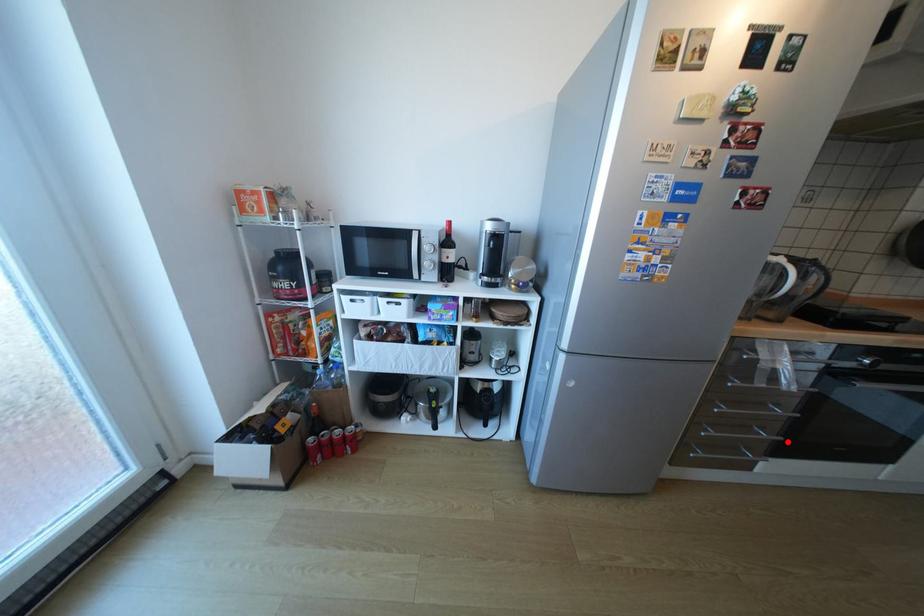
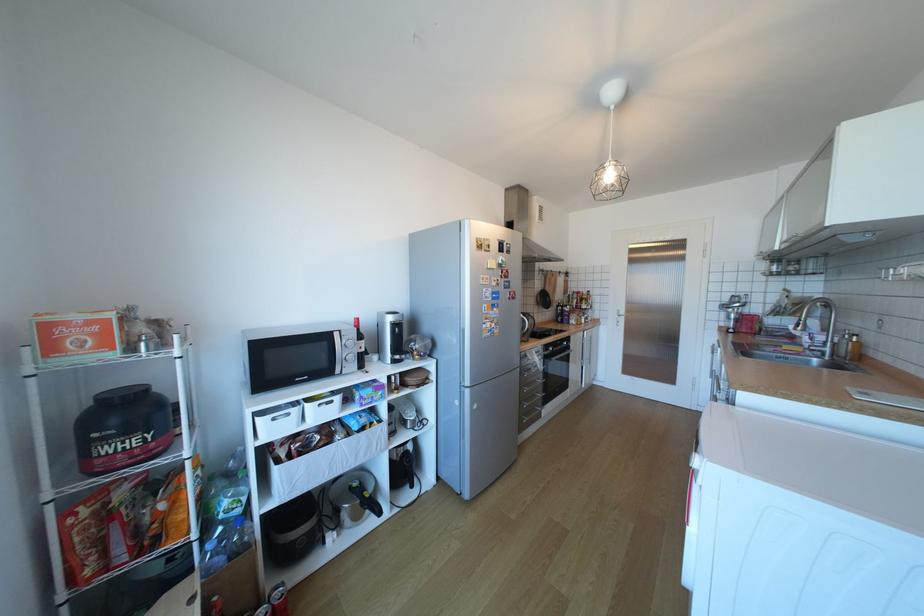
Find the pixel in the second image that matches the highlighted location in the first image.

(553, 395)